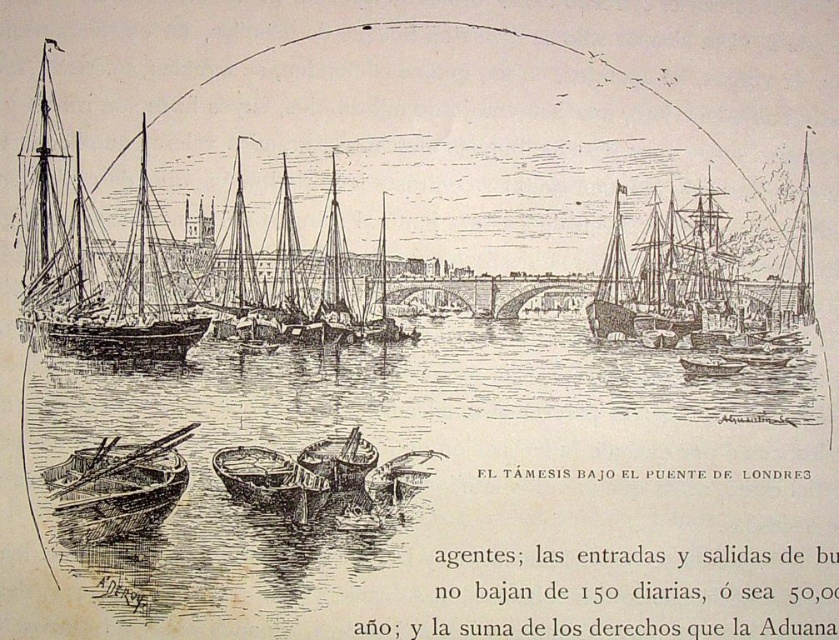
You are an artist trying to paint this scene. You have to decide which object to paint first based on their sizes. Which one should you start with, the transparent water at center or the smooth wood boat at left?

The transparent water at center is larger in size than the smooth wood boat at left, so you should start painting the transparent water at center first because it covers more of the canvas.

You are an artist trying to sketch this scene. You notice two points in the image at coordinates point [701,285] and point [347,467]. Which point should you focus on first if you want to start drawing the elements closest to you?

You should focus on point [347,467] first because it is closer to you than point [701,285], which is further away.